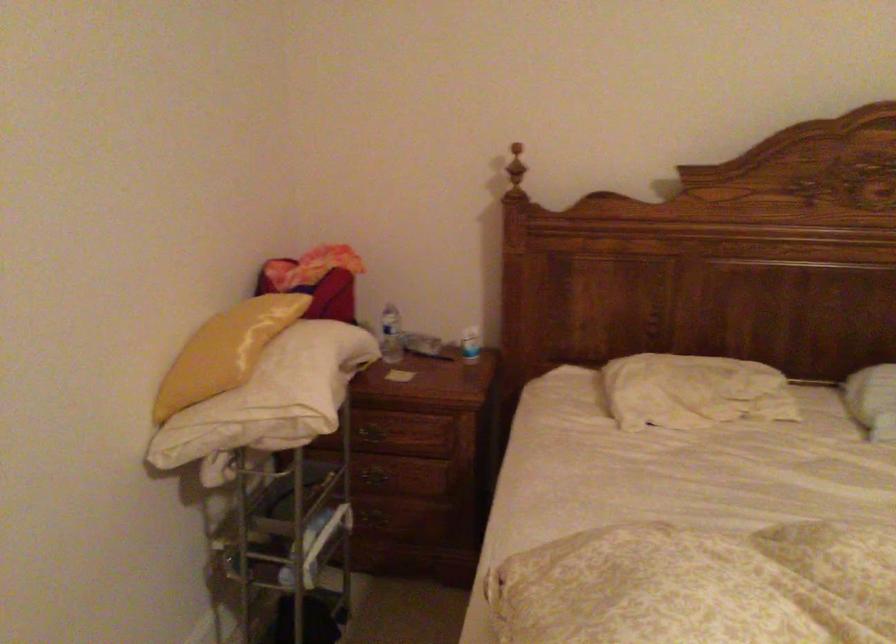
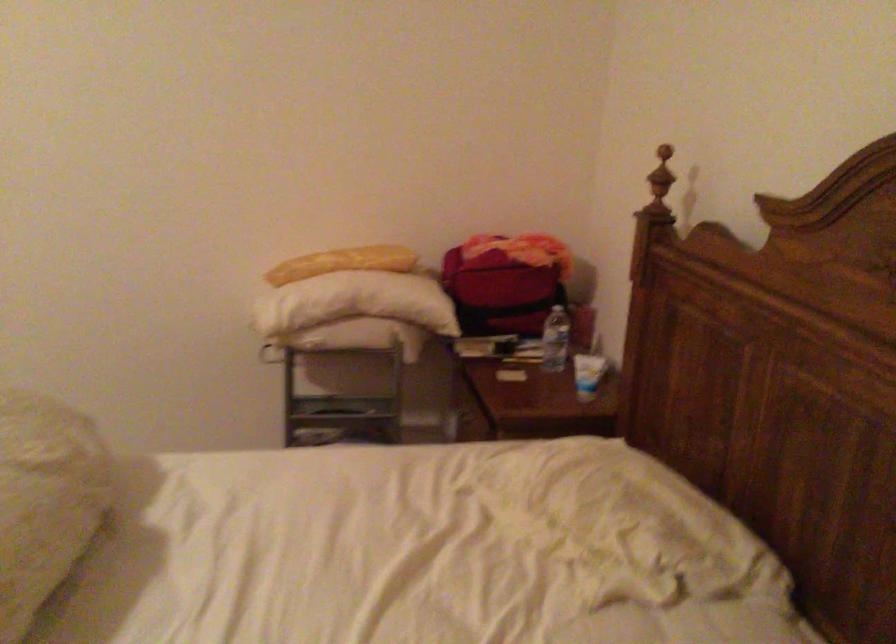
Where in the second image is the point corresponding to point (260, 335) from the first image?

(342, 263)